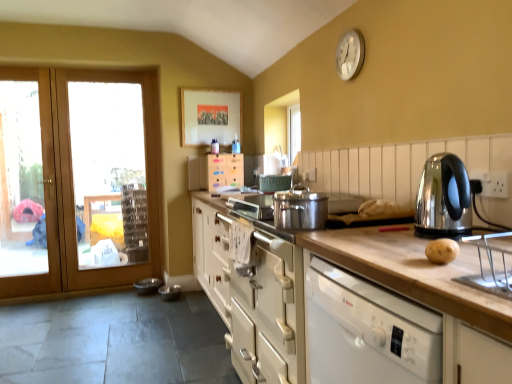
Question: From a real-world perspective, is clear glass door at left located beneath wooden door at left?

Choices:
 (A) no
 (B) yes

Answer: (B)

Question: Considering the relative sizes of clear glass door at left and wooden door at left in the image provided, is clear glass door at left bigger than wooden door at left?

Choices:
 (A) yes
 (B) no

Answer: (B)

Question: From a real-world perspective, is clear glass door at left on wooden door at left?

Choices:
 (A) yes
 (B) no

Answer: (B)

Question: Is clear glass door at left not near wooden door at left?

Choices:
 (A) yes
 (B) no

Answer: (B)

Question: Is clear glass door at left closer to camera compared to wooden door at left?

Choices:
 (A) yes
 (B) no

Answer: (B)

Question: From a real-world perspective, is shiny metallic kettle at right physically located above or below white matte cabinet at center, marked as the 1th cabinetry in a right-to-left arrangement?

Choices:
 (A) above
 (B) below

Answer: (A)

Question: Is point (429, 182) positioned closer to the camera than point (374, 231)?

Choices:
 (A) farther
 (B) closer

Answer: (B)

Question: Considering the positions of shiny metallic kettle at right and white matte cabinet at center, which ranks as the second cabinetry in left-to-right order, in the image, is shiny metallic kettle at right bigger or smaller than white matte cabinet at center, which ranks as the second cabinetry in left-to-right order,?

Choices:
 (A) small
 (B) big

Answer: (A)

Question: In the image, is shiny metallic kettle at right positioned in front of or behind white matte cabinet at center, the 1th cabinetry in the bottom-to-top sequence?

Choices:
 (A) behind
 (B) front

Answer: (B)

Question: Would you say clear glass door at left is inside or outside white wood cabinet at center, the second cabinetry in the front-to-back sequence?

Choices:
 (A) inside
 (B) outside

Answer: (B)

Question: From a real-world perspective, is clear glass door at left positioned above or below white wood cabinet at center, the 2th cabinetry positioned from the bottom?

Choices:
 (A) above
 (B) below

Answer: (B)

Question: In terms of width, does clear glass door at left look wider or thinner when compared to white wood cabinet at center, the 2th cabinetry positioned from the bottom?

Choices:
 (A) thin
 (B) wide

Answer: (A)

Question: Is clear glass door at left taller or shorter than white wood cabinet at center, the second cabinetry in the front-to-back sequence?

Choices:
 (A) tall
 (B) short

Answer: (A)

Question: Looking at the image, does white metallic clock at upper right seem bigger or smaller compared to wooden door at left?

Choices:
 (A) big
 (B) small

Answer: (B)

Question: Is white metallic clock at upper right inside or outside of wooden door at left?

Choices:
 (A) inside
 (B) outside

Answer: (B)